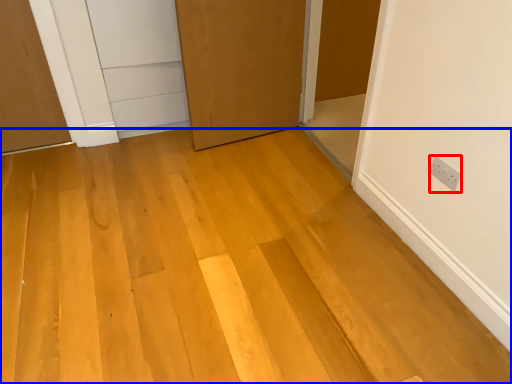
Question: Among these objects, which one is nearest to the camera, electric outlet (highlighted by a red box) or plywood (highlighted by a blue box)?

Choices:
 (A) electric outlet
 (B) plywood

Answer: (B)